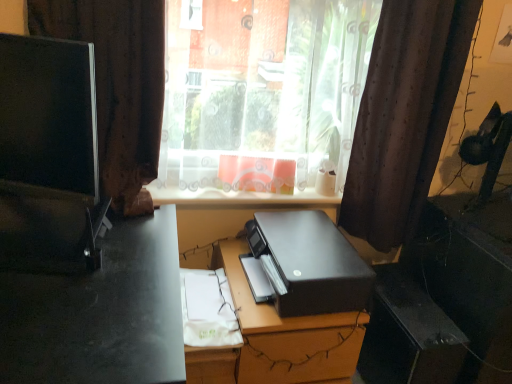
Where is `blank space situated above black plastic file cabinet at center (from a real-world perspective)`? blank space situated above black plastic file cabinet at center (from a real-world perspective) is located at coordinates (411, 294).